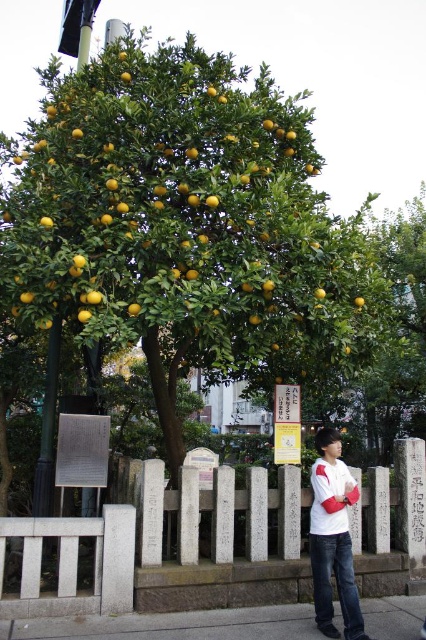
Is white stone fence at center to the right of gray concrete pavement at lower center from the viewer's perspective?

Incorrect, white stone fence at center is not on the right side of gray concrete pavement at lower center.

Which is below, white stone fence at center or gray concrete pavement at lower center?

gray concrete pavement at lower center

Between point (192, 497) and point (109, 618), which one is positioned in front?

Positioned in front is point (109, 618).

Image resolution: width=426 pixels, height=640 pixels. Identify the location of white stone fence at center. (161, 548).

Can you confirm if white stone fence at center is bigger than white matte shirt at center?

Correct, white stone fence at center is larger in size than white matte shirt at center.

Can you confirm if white stone fence at center is wider than white matte shirt at center?

Correct, the width of white stone fence at center exceeds that of white matte shirt at center.

What are the coordinates of `white stone fence at center` in the screenshot? It's located at (161, 548).

Does white matte shirt at center have a smaller size compared to yellow matte/orange at center?

Actually, white matte shirt at center might be larger than yellow matte/orange at center.

Can you confirm if white matte shirt at center is taller than yellow matte/orange at center?

Indeed, white matte shirt at center has a greater height compared to yellow matte/orange at center.

Find the location of a particular element. white matte shirt at center is located at coordinates (333, 538).

What are the coordinates of `white matte shirt at center` in the screenshot? It's located at (333, 538).